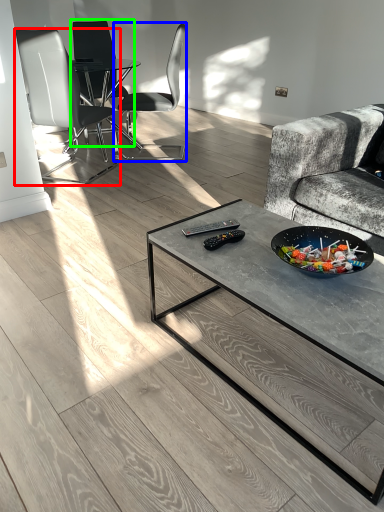
Question: Which is farther away from chair (highlighted by a red box)? chair (highlighted by a blue box) or chair (highlighted by a green box)?

Choices:
 (A) chair
 (B) chair

Answer: (A)